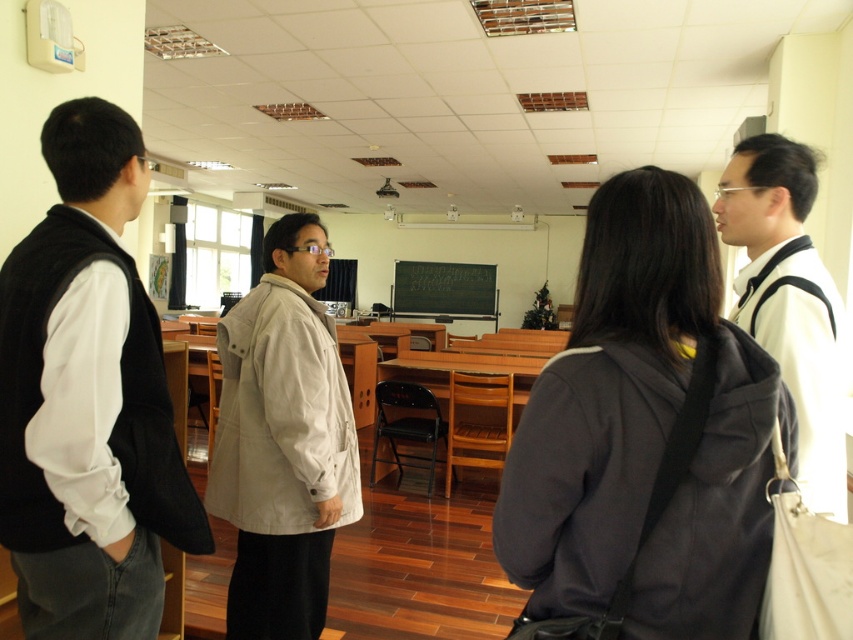
Who is shorter, white matte jacket at right or black chalkboard at center?

white matte jacket at right

Can you confirm if white matte jacket at right is shorter than black chalkboard at center?

Yes, white matte jacket at right is shorter than black chalkboard at center.

Is point (737, 230) farther from viewer compared to point (473, 317)?

That is False.

You are a GUI agent. You are given a task and a screenshot of the screen. Output one action in this format:
    pyautogui.click(x=<x>, y=<y>)
    Task: Click on the white matte jacket at right
    
    Given the screenshot: What is the action you would take?
    pyautogui.click(x=788, y=300)

Which is in front, point (688, 637) or point (781, 221)?

Point (688, 637)

Does dark gray fabric jacket at center appear on the left side of white matte jacket at right?

Indeed, dark gray fabric jacket at center is positioned on the left side of white matte jacket at right.

Is point (714, 305) positioned after point (723, 205)?

No, it is not.

Locate an element on the screen. This screenshot has height=640, width=853. dark gray fabric jacket at center is located at coordinates (643, 438).

Find the location of `black wool vest at left`. black wool vest at left is located at coordinates (86, 400).

Who is shorter, black wool vest at left or white matte jacket at right?

Standing shorter between the two is white matte jacket at right.

Which is in front, point (97, 301) or point (834, 372)?

Positioned in front is point (97, 301).

Where is `black wool vest at left`? The width and height of the screenshot is (853, 640). black wool vest at left is located at coordinates (86, 400).